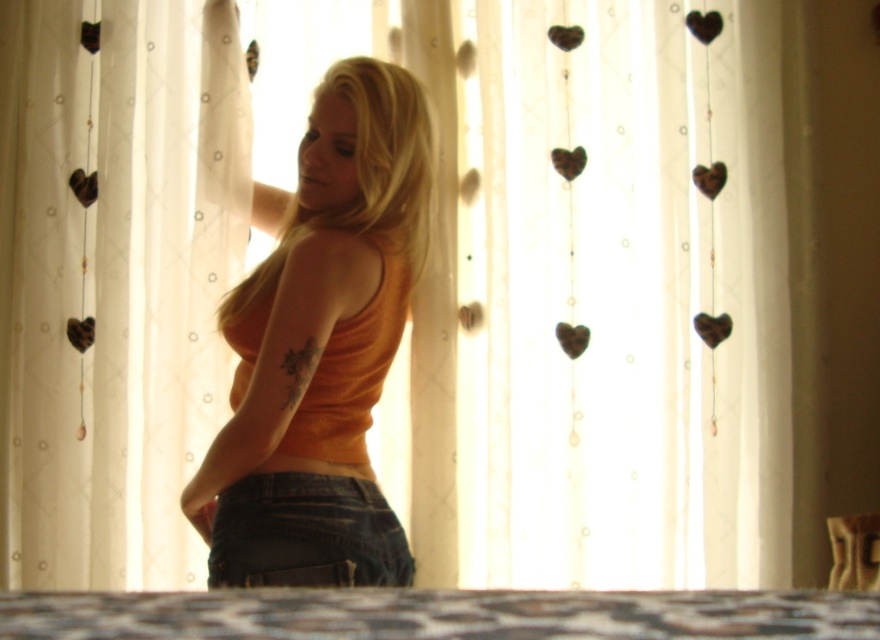
Which is more to the left, orange matte tank top at center or patterned fabric bed at lower center?

Positioned to the left is orange matte tank top at center.

Is orange matte tank top at center below patterned fabric bed at lower center?

No.

Who is more forward, (295, 538) or (854, 593)?

Positioned in front is point (854, 593).

Find the location of a particular element. The width and height of the screenshot is (880, 640). orange matte tank top at center is located at coordinates click(321, 349).

Does orange matte tank top at center have a lesser width compared to denim at center?

No.

Between point (270, 561) and point (365, 556), which one is positioned in front?

Positioned in front is point (270, 561).

This screenshot has width=880, height=640. I want to click on orange matte tank top at center, so click(x=321, y=349).

Does denim at center have a lesser width compared to wooden heart at center?

No, denim at center is not thinner than wooden heart at center.

Who is more forward, (341,577) or (699,170)?

Point (341,577) is in front.

You are a GUI agent. You are given a task and a screenshot of the screen. Output one action in this format:
    pyautogui.click(x=<x>, y=<y>)
    Task: Click on the denim at center
    The image size is (880, 640).
    Given the screenshot: What is the action you would take?
    pyautogui.click(x=306, y=532)